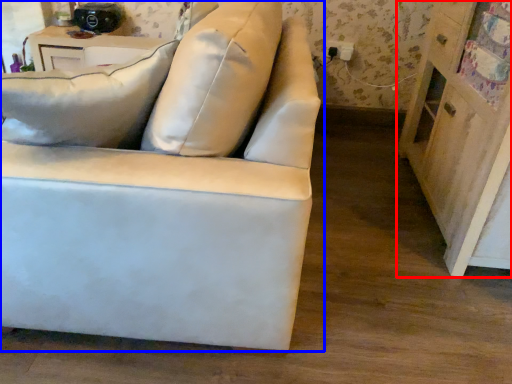
Question: Among these objects, which one is farthest to the camera, dresser (highlighted by a red box) or studio couch (highlighted by a blue box)?

Choices:
 (A) dresser
 (B) studio couch

Answer: (A)